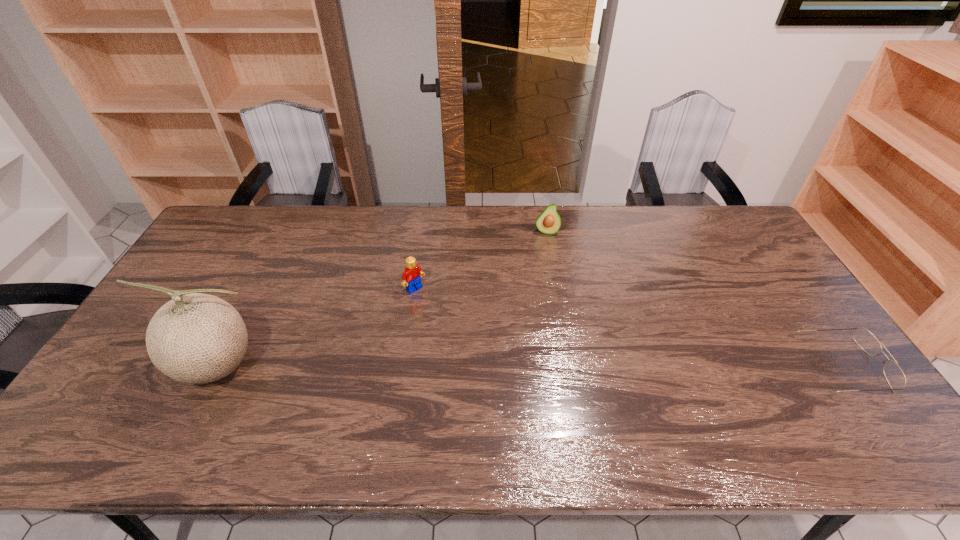
This screenshot has height=540, width=960. I want to click on the tallest object, so click(x=197, y=338).

This screenshot has height=540, width=960. In order to click on cantaloup in this screenshot , I will do `click(197, 338)`.

I want to click on the shortest object, so click(895, 377).

Locate an element on the screen. This screenshot has height=540, width=960. the rightmost object is located at coordinates (895, 377).

I want to click on Lego, so click(x=411, y=277).

I want to click on the third object from right to left, so click(411, 277).

I want to click on avocado, so click(x=549, y=221).

Identify the location of the farthest object. The image size is (960, 540). (549, 221).

Where is `vacant area situated on the right of the cantaloup`? The image size is (960, 540). vacant area situated on the right of the cantaloup is located at coordinates (322, 366).

Find the location of a particular element. The height and width of the screenshot is (540, 960). free spot located 0.140m on the front-facing side of the Lego is located at coordinates (451, 319).